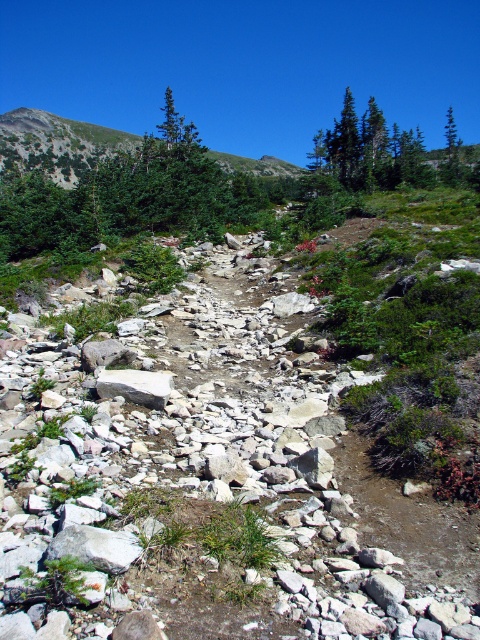
Question: Is green matte tree at upper center above gray/rough rock at center?

Choices:
 (A) yes
 (B) no

Answer: (A)

Question: Which point appears farthest from the camera in this image?

Choices:
 (A) (396, 136)
 (B) (149, 397)

Answer: (A)

Question: Is green matte tree at upper center further to camera compared to gray/rough rock at center?

Choices:
 (A) no
 (B) yes

Answer: (B)

Question: Is the position of green matte tree at upper center less distant than that of gray/rough rock at center?

Choices:
 (A) no
 (B) yes

Answer: (A)